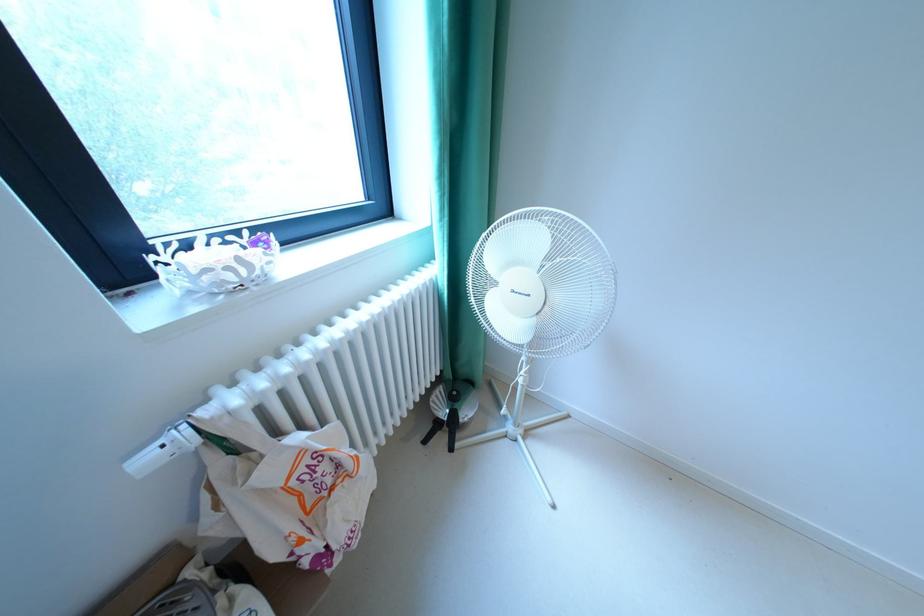
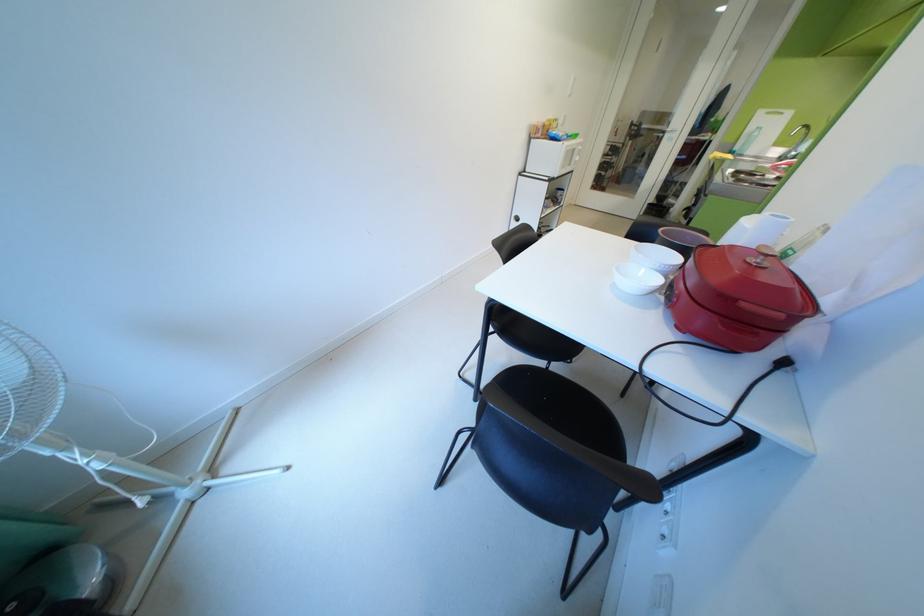
First-person continuous shooting, in which direction is the camera rotating?

The rotation direction of the camera is right-down.